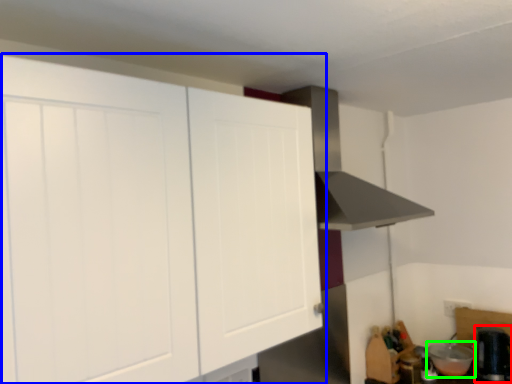
Question: Estimate the real-world distances between objects in this image. Which object is farther from appliance (highlighted by a red box), cabinetry (highlighted by a blue box) or appliance (highlighted by a green box)?

Choices:
 (A) cabinetry
 (B) appliance

Answer: (A)